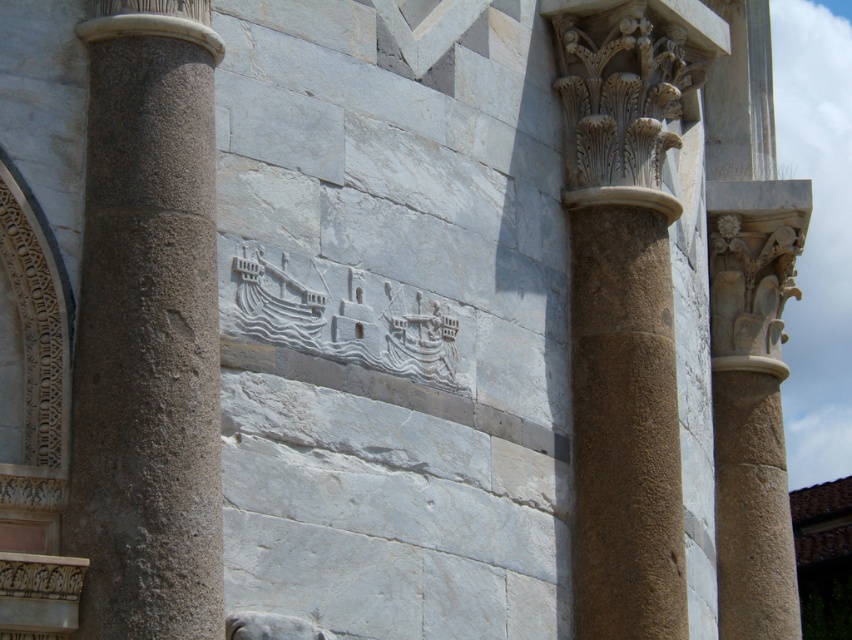
Which of these two, gray stone column at left or brown stone column at right, stands shorter?

With less height is gray stone column at left.

Between gray stone column at left and brown stone column at right, which one appears on the left side from the viewer's perspective?

gray stone column at left is more to the left.

The width and height of the screenshot is (852, 640). Describe the element at coordinates (147, 328) in the screenshot. I see `gray stone column at left` at that location.

Locate an element on the screen. This screenshot has height=640, width=852. gray stone column at left is located at coordinates (147, 328).

Is gray stone column at left below smooth stone column at upper right?

Yes, gray stone column at left is below smooth stone column at upper right.

Is gray stone column at left positioned before smooth stone column at upper right?

Yes, it is.

Is point (133, 164) closer to camera compared to point (776, 376)?

Yes, point (133, 164) is in front of point (776, 376).

Locate an element on the screen. Image resolution: width=852 pixels, height=640 pixels. gray stone column at left is located at coordinates (147, 328).

Is point (600, 278) positioned behind point (753, 435)?

No.

Does brown stone column at right appear over smooth stone column at upper right?

Actually, brown stone column at right is below smooth stone column at upper right.

Is point (613, 33) closer to camera compared to point (775, 406)?

That is True.

The width and height of the screenshot is (852, 640). I want to click on brown stone column at right, so click(625, 301).